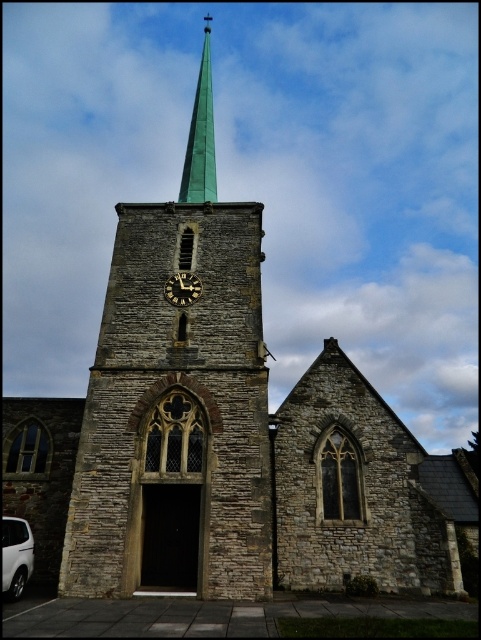
Question: Which of these objects is positioned farthest from the brown stone clock tower at center?

Choices:
 (A) gold metallic clock at center
 (B) white matte van at lower left
 (C) green glass spire at upper center

Answer: (B)

Question: Does white matte van at lower left appear on the right side of gold metallic clock at center?

Choices:
 (A) no
 (B) yes

Answer: (A)

Question: Which point appears farthest from the camera in this image?

Choices:
 (A) (182, 301)
 (B) (186, 225)
 (C) (15, 595)
 (D) (212, 134)

Answer: (D)

Question: Can you confirm if brown stone clock tower at center is positioned to the right of green glass spire at upper center?

Choices:
 (A) no
 (B) yes

Answer: (B)

Question: Which point is closer to the camera?

Choices:
 (A) (197, 161)
 (B) (4, 579)
 (C) (261, 508)

Answer: (B)

Question: Does brown stone clock tower at center have a lesser width compared to gold metallic clock at center?

Choices:
 (A) yes
 (B) no

Answer: (B)